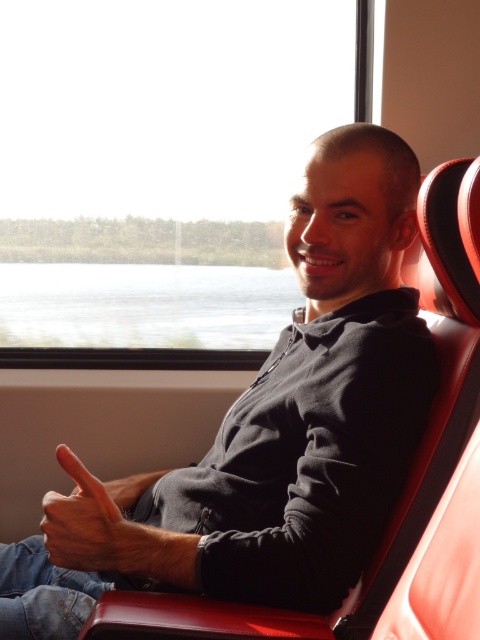
You are standing in front of a train seat. There is a point at coordinates point (x=350, y=365). Can you reach it with your hand?

The point (x=350, y=365) is 1.09 meters away from you, so you cannot reach it with your hand since it is too far.

In the scene shown: You are a passenger on a train and want to see the view outside through the transparent glass window at upper center while keeping your matte black hoodie at center on. Can you do both at the same time?

The transparent glass window at upper center is positioned over the matte black hoodie at center, so you can see the view outside through the transparent glass window at upper center while keeping your matte black hoodie at center on.

You are a delivery drone operator. Your drone is 1.8 meters wide. You want to fly the drone through the space between the transparent glass window at upper center and the camera. Can the drone pass through that space?

The distance between the transparent glass window at upper center and the camera is 2.02 meters. Since the drone is 1.8 meters wide, it can pass through the space as the width is sufficient.